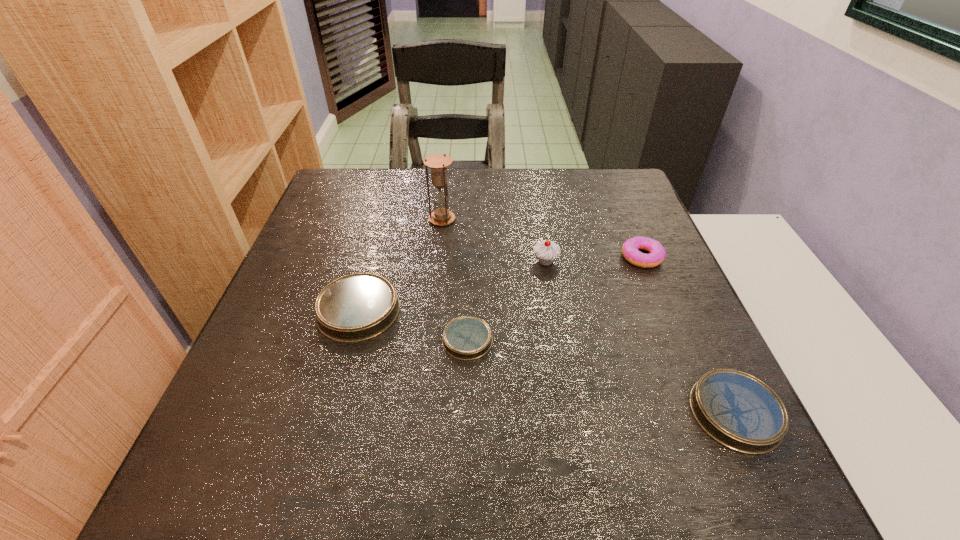
The height and width of the screenshot is (540, 960). What are the coordinates of `vacant space in between the nearest compass and the third object from right to left` in the screenshot? It's located at (640, 337).

I want to click on vacant area that lies between the nearest compass and the second compass from left to right, so click(x=601, y=376).

At what (x,y) coordinates should I click in order to perform the action: click on free spot between the shortest object and the farthest object. Please return your answer as a coordinate pair (x, y). This screenshot has width=960, height=540. Looking at the image, I should click on (455, 280).

Locate an element on the screen. vacant area that lies between the leftmost compass and the shortest object is located at coordinates (413, 326).

The height and width of the screenshot is (540, 960). Identify the location of vacant point located between the hourglass and the shortest object. (455, 280).

Where is `free spot between the second compass from right to left and the nearest compass`? free spot between the second compass from right to left and the nearest compass is located at coordinates (601, 376).

At what (x,y) coordinates should I click in order to perform the action: click on vacant space that's between the doughnut and the leftmost object. Please return your answer as a coordinate pair (x, y). The image size is (960, 540). Looking at the image, I should click on (500, 284).

Locate an element on the screen. The width and height of the screenshot is (960, 540). the fourth closest object relative to the doughnut is located at coordinates (438, 163).

Identify the location of object that is the second closest to the leftmost object. (438, 163).

The width and height of the screenshot is (960, 540). What are the coordinates of `compass object that ranks as the closest to the doughnut` in the screenshot? It's located at (737, 410).